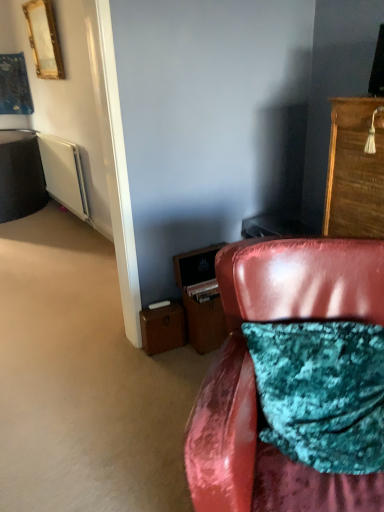
At what (x,y) coordinates should I click in order to perform the action: click on vacant area that is in front of wooden drawer at lower center, which is counted as the second drawer, starting from the left. Please return your answer as a coordinate pair (x, y). Looking at the image, I should click on (194, 361).